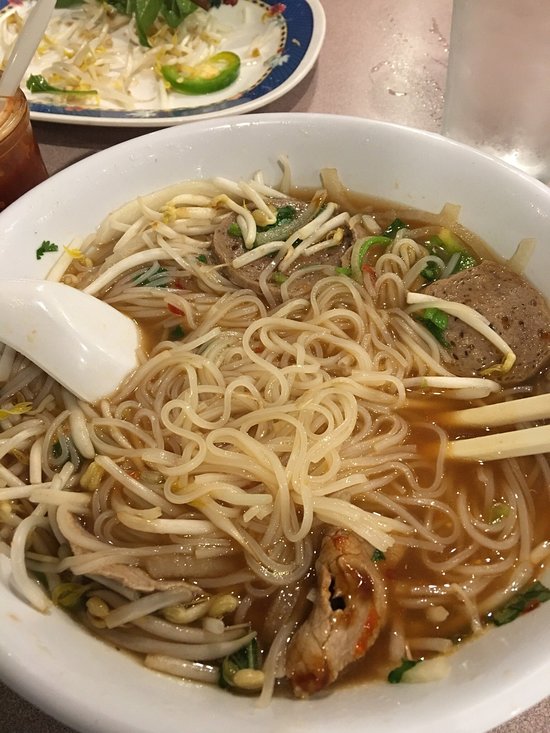
This screenshot has width=550, height=733. What are the coordinates of `spoon` in the screenshot? It's located at (55, 330).